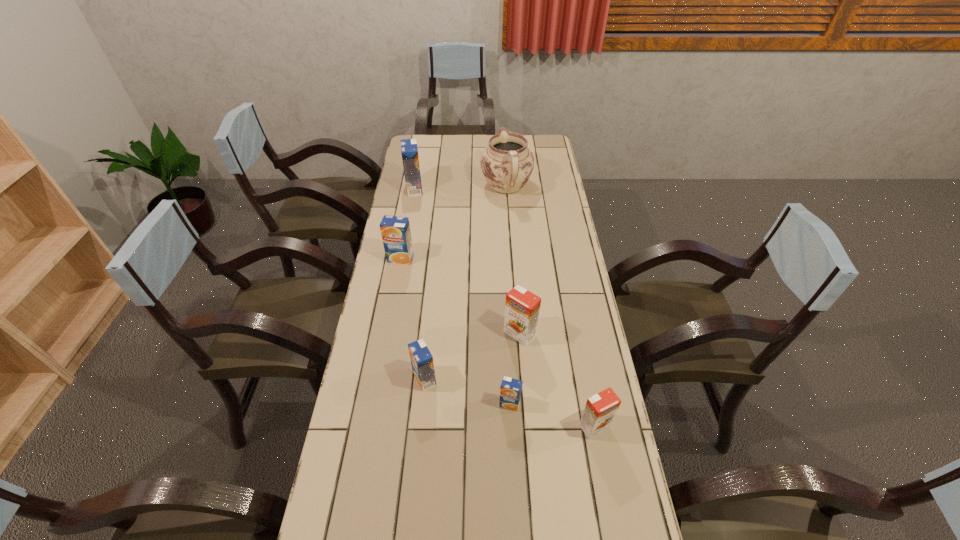
Locate an element on the screen. the nearer orange orange juice is located at coordinates (599, 412).

Where is `the shortest orange_juice`? The image size is (960, 540). the shortest orange_juice is located at coordinates (510, 390).

This screenshot has width=960, height=540. In order to click on the shortest object in this screenshot , I will do `click(510, 390)`.

The image size is (960, 540). Identify the location of vacant space located 0.050m on the spout of the purple pitcher. (505, 163).

Locate an element on the screen. This screenshot has width=960, height=540. free spot located on the spout of the purple pitcher is located at coordinates (504, 156).

You are a GUI agent. You are given a task and a screenshot of the screen. Output one action in this format:
    pyautogui.click(x=<x>, y=<y>)
    Task: Click on the vacant space located on the spout of the purple pitcher
    The height and width of the screenshot is (540, 960).
    Given the screenshot: What is the action you would take?
    pyautogui.click(x=503, y=140)

The height and width of the screenshot is (540, 960). In order to click on vacant position located 0.320m on the front of the farthest orange_juice in this screenshot , I will do `click(404, 245)`.

At what (x,y) coordinates should I click in order to perform the action: click on vacant space located on the back of the third farthest object. Please return your answer as a coordinate pair (x, y). Looking at the image, I should click on (410, 208).

The height and width of the screenshot is (540, 960). Find the location of `vacant area situated on the front of the fourth nearest object`. vacant area situated on the front of the fourth nearest object is located at coordinates (529, 454).

Identify the location of free region located on the front of the fifth farthest object. The width and height of the screenshot is (960, 540). (420, 421).